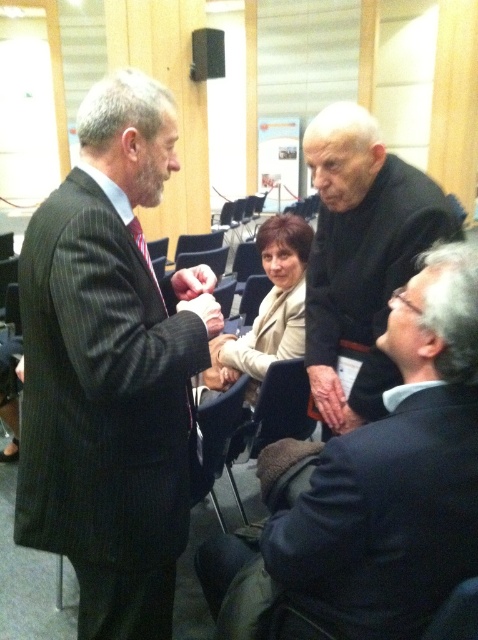
Question: Estimate the real-world distances between objects in this image. Which object is farther from the dry skin hand at lower center?

Choices:
 (A) matte black hand at center
 (B) smooth skin hand at lower center
 (C) black matte suit at upper right
 (D) dark suit at center

Answer: (D)

Question: Which point is farther to the camera?

Choices:
 (A) black matte suit at upper right
 (B) smooth skin hand at lower center
 (C) dark pinstripe suit at left
 (D) dark suit at center

Answer: (B)

Question: Does dark pinstripe suit at left lie behind dry skin hand at lower center?

Choices:
 (A) yes
 (B) no

Answer: (B)

Question: Does dark pinstripe suit at left lie in front of smooth skin hand at lower center?

Choices:
 (A) no
 (B) yes

Answer: (B)

Question: Based on their relative distances, which object is nearer to the dark suit at center?

Choices:
 (A) smooth skin hand at lower center
 (B) matte black hand at center

Answer: (A)

Question: Where is black matte suit at upper right located in relation to dry skin hand at lower center in the image?

Choices:
 (A) above
 (B) below

Answer: (A)